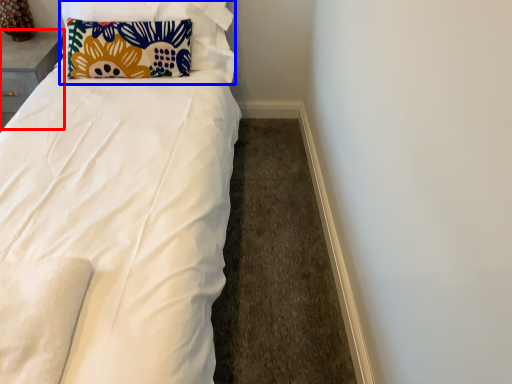
Question: Among these objects, which one is nearest to the camera, table (highlighted by a red box) or pillow (highlighted by a blue box)?

Choices:
 (A) table
 (B) pillow

Answer: (B)